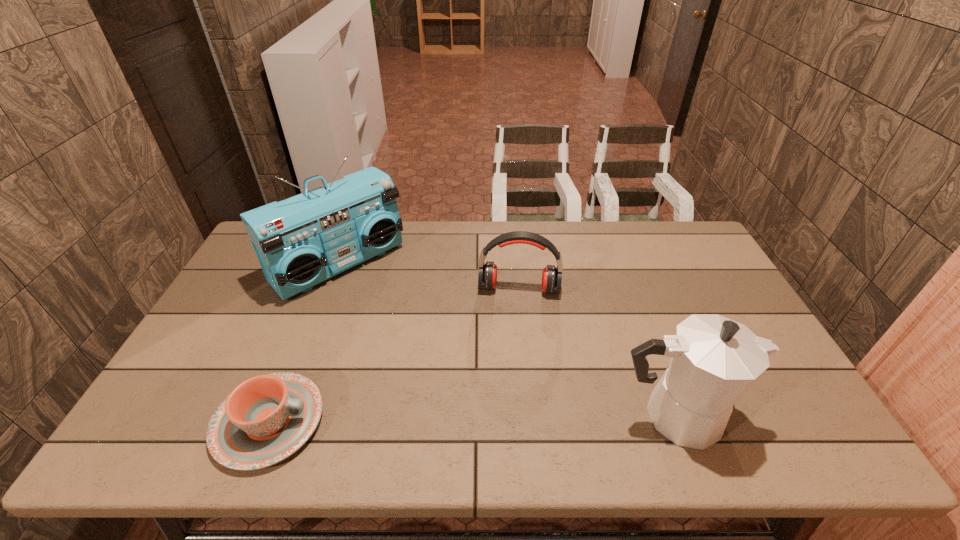
Identify the location of free space on the desktop that is between the chinaware and the coffeepot and is positioned on the ear cups of the earphone. Image resolution: width=960 pixels, height=540 pixels. (514, 418).

Find the location of a particular element. The image size is (960, 540). free spot on the desktop that is between the chinaware and the second tallest object and is positioned on the front-facing side of the radio receiver is located at coordinates (502, 418).